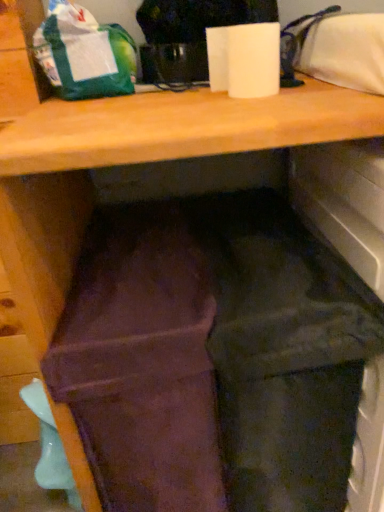
Question: Is white matte paper towel at upper center facing towards green matte bag at upper left?

Choices:
 (A) no
 (B) yes

Answer: (A)

Question: Can you confirm if white matte paper towel at upper center is taller than green matte bag at upper left?

Choices:
 (A) yes
 (B) no

Answer: (B)

Question: Are white matte paper towel at upper center and green matte bag at upper left making contact?

Choices:
 (A) no
 (B) yes

Answer: (A)

Question: Considering the relative sizes of white matte paper towel at upper center and green matte bag at upper left in the image provided, is white matte paper towel at upper center thinner than green matte bag at upper left?

Choices:
 (A) no
 (B) yes

Answer: (B)

Question: Is white matte paper towel at upper center completely or partially outside of green matte bag at upper left?

Choices:
 (A) yes
 (B) no

Answer: (A)

Question: Would you say brown suede wallet at center is to the left or to the right of matte teal plastic spoon at lower left in the picture?

Choices:
 (A) left
 (B) right

Answer: (B)

Question: From their relative heights in the image, would you say brown suede wallet at center is taller or shorter than matte teal plastic spoon at lower left?

Choices:
 (A) short
 (B) tall

Answer: (B)

Question: In the image, is brown suede wallet at center positioned in front of or behind matte teal plastic spoon at lower left?

Choices:
 (A) behind
 (B) front

Answer: (B)

Question: In terms of width, does brown suede wallet at center look wider or thinner when compared to matte teal plastic spoon at lower left?

Choices:
 (A) thin
 (B) wide

Answer: (B)

Question: From a real-world perspective, relative to green matte bag at upper left, is matte teal plastic spoon at lower left vertically above or below?

Choices:
 (A) below
 (B) above

Answer: (A)

Question: Considering their positions, is matte teal plastic spoon at lower left located in front of or behind green matte bag at upper left?

Choices:
 (A) front
 (B) behind

Answer: (B)

Question: Considering the positions of matte teal plastic spoon at lower left and green matte bag at upper left in the image, is matte teal plastic spoon at lower left wider or thinner than green matte bag at upper left?

Choices:
 (A) thin
 (B) wide

Answer: (A)

Question: In the image, is matte teal plastic spoon at lower left on the left side or the right side of green matte bag at upper left?

Choices:
 (A) right
 (B) left

Answer: (B)

Question: Is brown suede wallet at center taller or shorter than green matte bag at upper left?

Choices:
 (A) tall
 (B) short

Answer: (A)

Question: From a real-world perspective, is brown suede wallet at center positioned above or below green matte bag at upper left?

Choices:
 (A) below
 (B) above

Answer: (A)